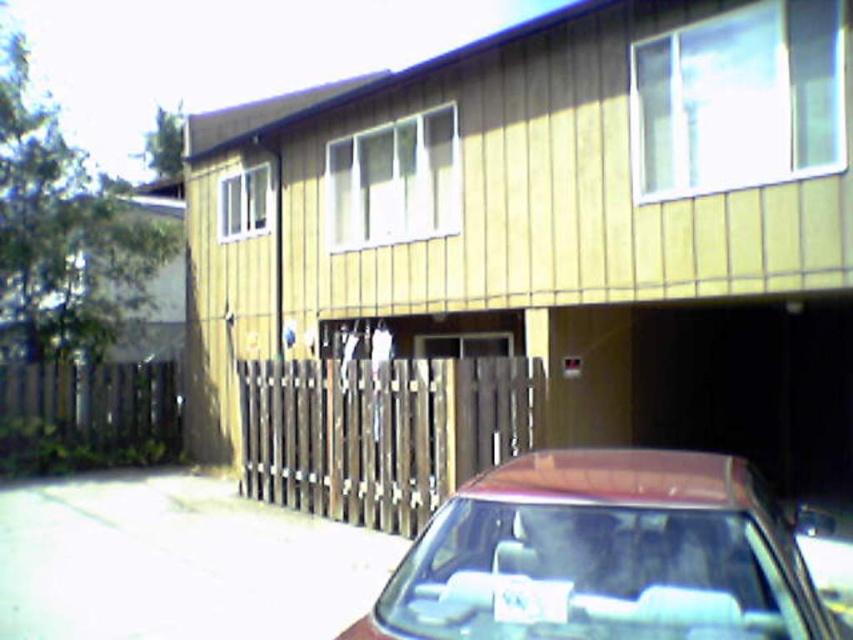
Question: Which of the following is the closest to the observer?

Choices:
 (A) shiny maroon sedan at lower center
 (B) white plastic license plate at center

Answer: (A)

Question: Is shiny maroon sedan at lower center further to the viewer compared to white plastic license plate at center?

Choices:
 (A) yes
 (B) no

Answer: (B)

Question: Which point is farther from the camera taking this photo?

Choices:
 (A) (514, 576)
 (B) (73, 502)

Answer: (B)

Question: Which of the following is the closest to the observer?

Choices:
 (A) shiny maroon sedan at lower center
 (B) white concrete driveway at lower left

Answer: (A)

Question: Is shiny maroon sedan at lower center further to camera compared to white concrete driveway at lower left?

Choices:
 (A) yes
 (B) no

Answer: (B)

Question: Does shiny maroon sedan at lower center have a lesser width compared to white plastic license plate at center?

Choices:
 (A) no
 (B) yes

Answer: (A)